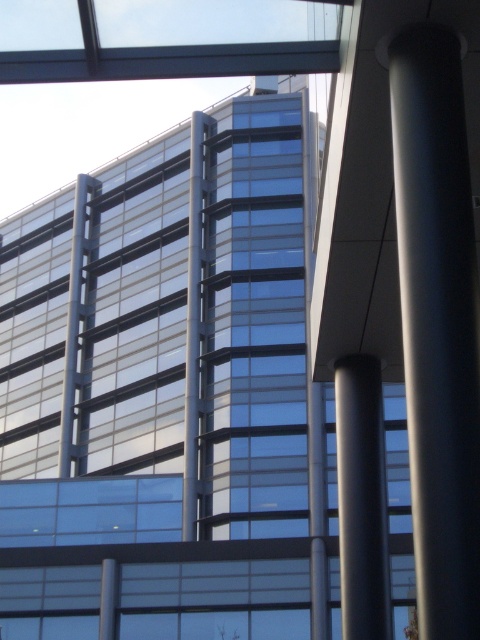
Question: Among these points, which one is nearest to the camera?

Choices:
 (A) (348, 525)
 (B) (415, 422)

Answer: (B)

Question: Which object is closer to the camera taking this photo?

Choices:
 (A) satin black column at right
 (B) smooth gray column at center

Answer: (A)

Question: Is the position of satin black column at right less distant than that of smooth gray column at center?

Choices:
 (A) yes
 (B) no

Answer: (A)

Question: Does satin black column at right have a lesser width compared to smooth gray column at center?

Choices:
 (A) no
 (B) yes

Answer: (B)

Question: Which point is closer to the camera taking this photo?

Choices:
 (A) (415, 316)
 (B) (348, 490)

Answer: (A)

Question: Can you confirm if satin black column at right is bigger than smooth gray column at center?

Choices:
 (A) no
 (B) yes

Answer: (A)